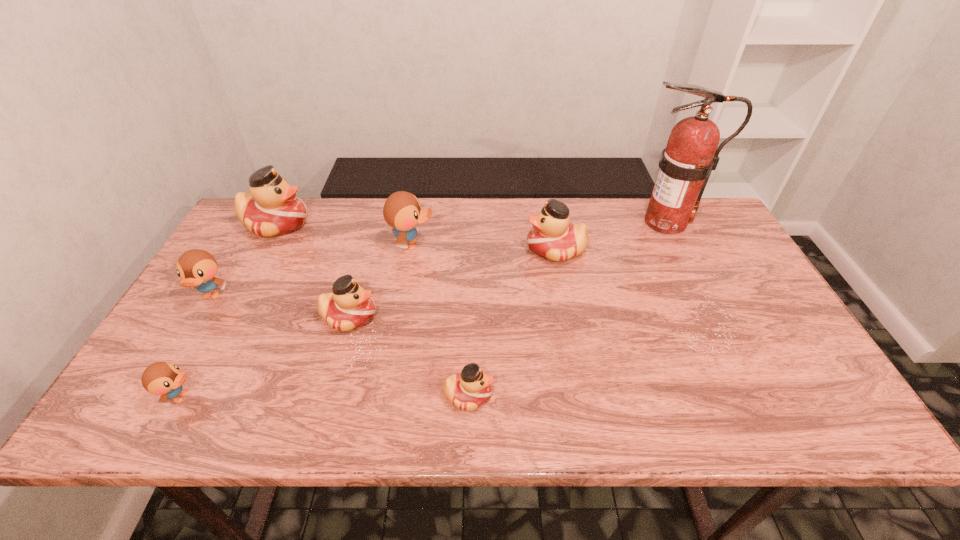
Select which blue duck is the closest to the second nearest red duck. Please provide its 2D coordinates. Your answer should be formatted as a tuple, i.e. [(x, y)], where the tuple contains the x and y coordinates of a point satisfying the conditions above.

[(402, 211)]

Identify which blue duck is located as the third nearest to the leftmost red duck. Please provide its 2D coordinates. Your answer should be formatted as a tuple, i.e. [(x, y)], where the tuple contains the x and y coordinates of a point satisfying the conditions above.

[(161, 378)]

Find the location of a particular element. The image size is (960, 540). vacant space that satisfies the following two spatial constraints: 1. on the face of the biggest red duck; 2. on the front-facing side of the second nearest blue duck is located at coordinates (237, 296).